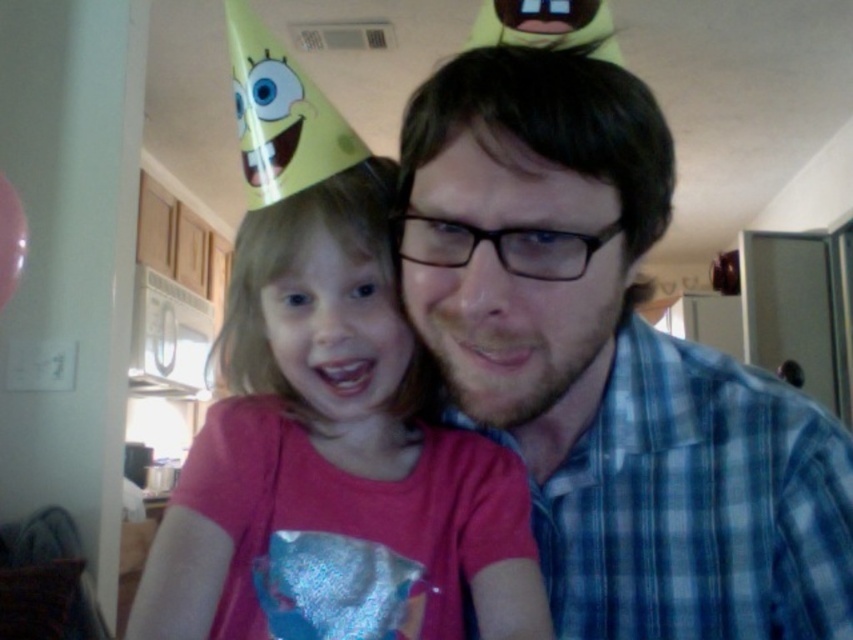
Does blue plaid shirt at center have a larger size compared to pink matte shirt at center?

Correct, blue plaid shirt at center is larger in size than pink matte shirt at center.

Who is positioned more to the right, blue plaid shirt at center or pink matte shirt at center?

From the viewer's perspective, blue plaid shirt at center appears more on the right side.

What do you see at coordinates (614, 369) in the screenshot? I see `blue plaid shirt at center` at bounding box center [614, 369].

Locate an element on the screen. Image resolution: width=853 pixels, height=640 pixels. blue plaid shirt at center is located at coordinates (614, 369).